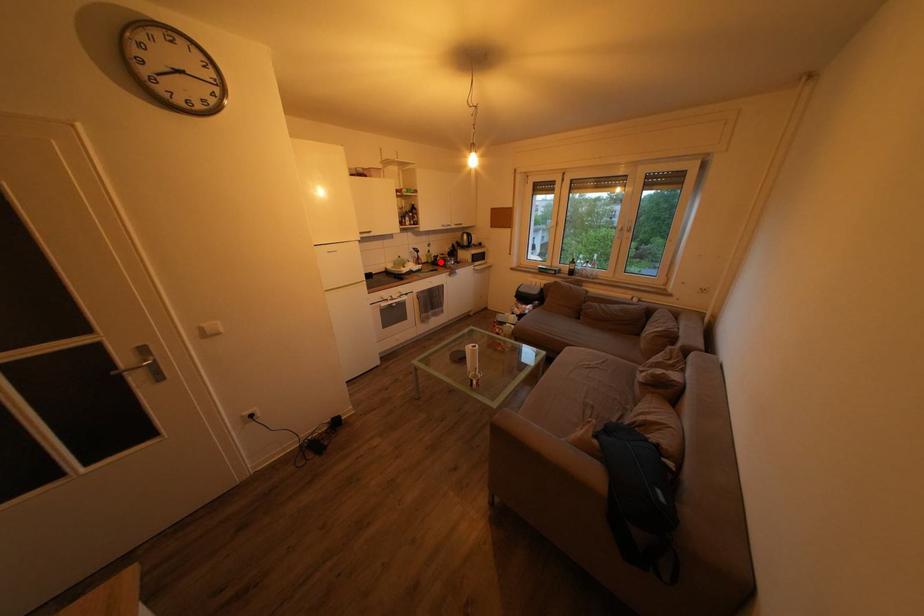
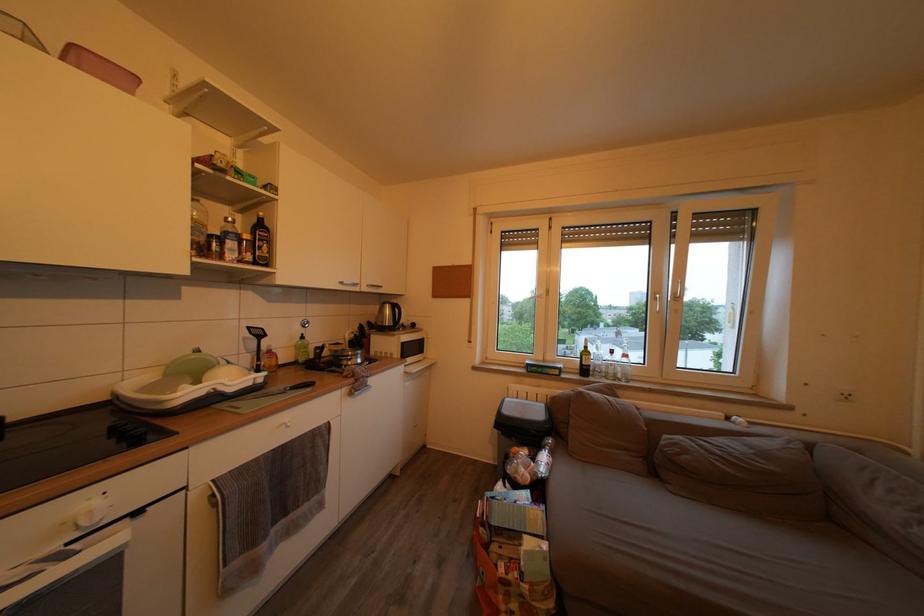
Where in the second image is the point corresponding to the highlighted location from the first image?

(320, 353)